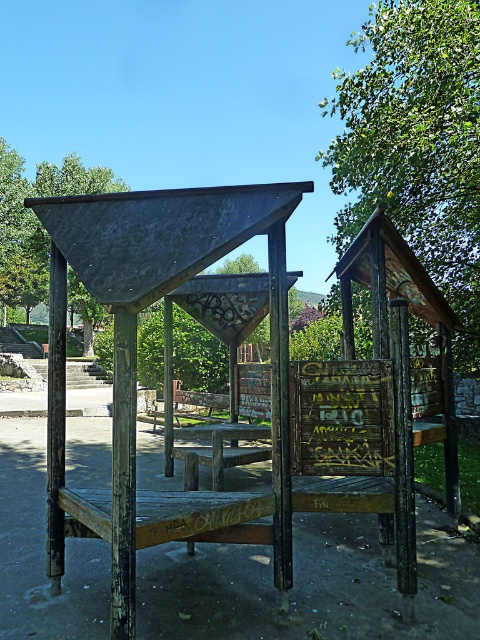
Looking at this image, you are standing in the park and see the rusty wood gazebo at center and the green leafy tree at upper right. Which object is taller?

The green leafy tree at upper right is taller than the rusty wood gazebo at center.

You are a park visitor standing at the entrance of the park. You see the rusty wood gazebo at center and the dark green wood at upper left. Which object is located above the other?

The dark green wood at upper left is located above the rusty wood gazebo at center because the rusty wood gazebo at center is positioned under dark green wood at upper left.

You are planning to have a picnic under the green leafy tree at upper right and the wooden picnic table at center. Which object provides more shade?

The green leafy tree at upper right is positioned over the wooden picnic table at center, so the tree provides more shade over the picnic table.